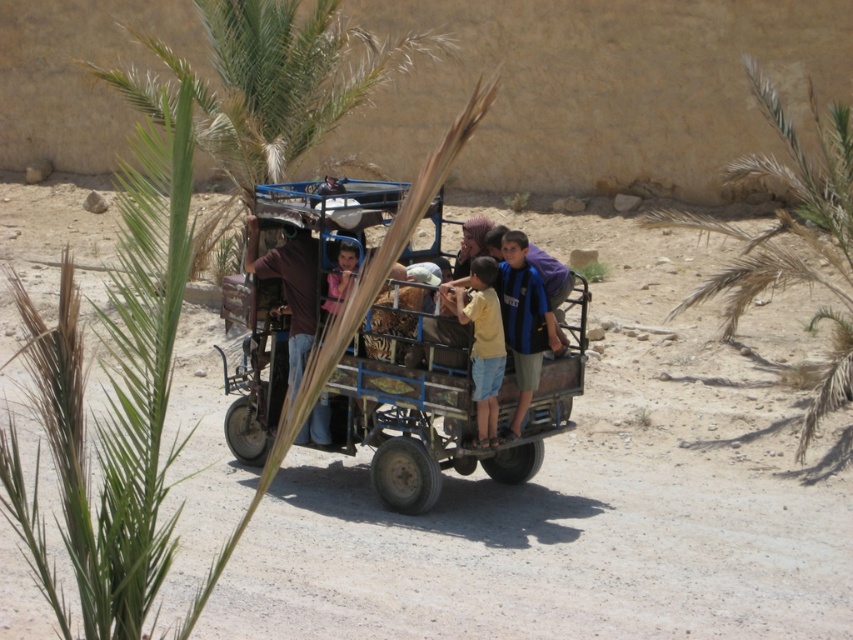
You are a photographer trying to capture a photo of the passengers in the tuk tuk. You want to ensure both the yellow matte shirt at center and the matte pink shirt at center are visible in the frame. Which passenger should you focus on to ensure both are in the shot?

The yellow matte shirt at center is taller than the matte pink shirt at center, so focusing on the taller passenger wearing the yellow matte shirt at center will help ensure both are visible in the frame.